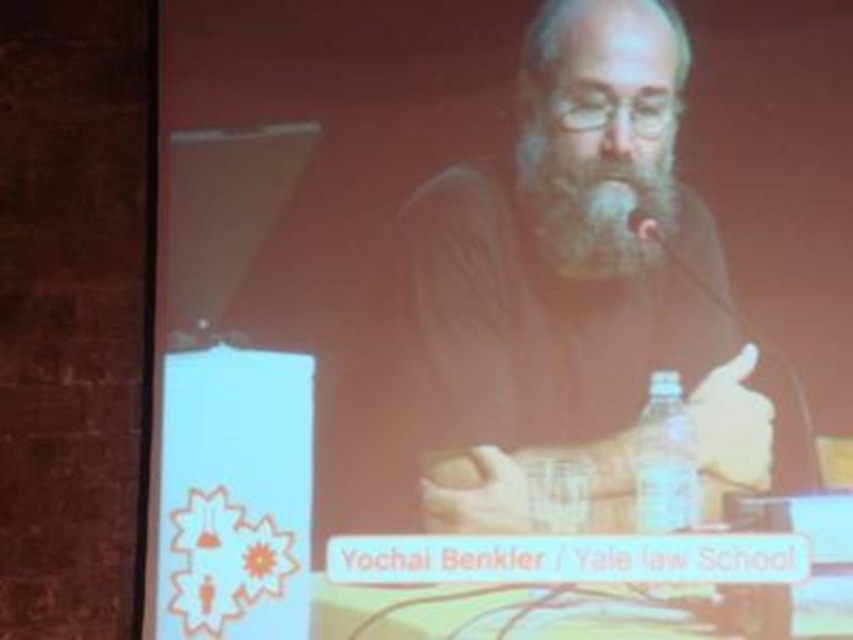
Question: Is white soft beard at center bigger than clear plastic bottle at lower right?

Choices:
 (A) yes
 (B) no

Answer: (A)

Question: Which object is closer to the camera taking this photo?

Choices:
 (A) white soft beard at center
 (B) clear plastic bottle at lower right

Answer: (B)

Question: Considering the real-world distances, which object is farthest from the white soft beard at center?

Choices:
 (A) clear plastic bottle at lower right
 (B) smooth skin man at center

Answer: (A)

Question: Is smooth skin man at center positioned behind clear plastic bottle at lower right?

Choices:
 (A) no
 (B) yes

Answer: (B)

Question: Does smooth skin man at center appear over white soft beard at center?

Choices:
 (A) yes
 (B) no

Answer: (B)

Question: Which point is closer to the camera?

Choices:
 (A) clear plastic bottle at lower right
 (B) white soft beard at center
 (C) smooth skin man at center

Answer: (A)